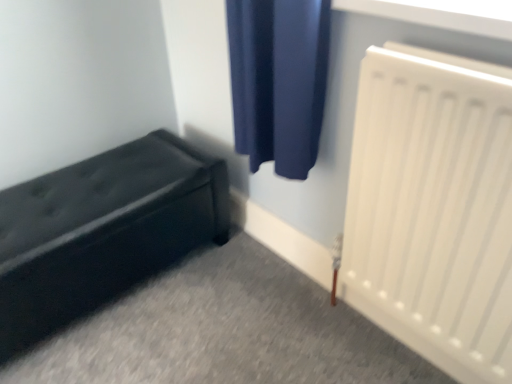
Find the location of a particular element. black leather bench at lower left is located at coordinates (102, 231).

Based on the photo, what is the approximate width of black leather bench at lower left?

black leather bench at lower left is 46.12 centimeters in width.

Measure the distance between black leather bench at lower left and camera.

black leather bench at lower left and camera are 1.06 meters apart.

The width and height of the screenshot is (512, 384). Describe the element at coordinates (102, 231) in the screenshot. I see `black leather bench at lower left` at that location.

Find the location of a particular element. The height and width of the screenshot is (384, 512). white plastic radiator at right is located at coordinates (433, 208).

This screenshot has width=512, height=384. Describe the element at coordinates (433, 208) in the screenshot. I see `white plastic radiator at right` at that location.

Image resolution: width=512 pixels, height=384 pixels. I want to click on black leather bench at lower left, so click(102, 231).

Which object is positioned more to the left, white plastic radiator at right or black leather bench at lower left?

Positioned to the left is black leather bench at lower left.

Is white plastic radiator at right in front of or behind black leather bench at lower left in the image?

white plastic radiator at right is in front of black leather bench at lower left.

Considering the positions of point (445, 181) and point (115, 172), is point (445, 181) closer or farther from the camera than point (115, 172)?

Point (445, 181) appears to be closer to the viewer than point (115, 172).

From the image's perspective, is white plastic radiator at right under black leather bench at lower left?

No, from the image's perspective, white plastic radiator at right is not beneath black leather bench at lower left.

From a real-world perspective, which is physically below, white plastic radiator at right or black leather bench at lower left?

black leather bench at lower left, from a real-world perspective.

Between white plastic radiator at right and black leather bench at lower left, which one has larger width?

With larger width is black leather bench at lower left.

Considering the relative sizes of white plastic radiator at right and black leather bench at lower left in the image provided, is white plastic radiator at right shorter than black leather bench at lower left?

In fact, white plastic radiator at right may be taller than black leather bench at lower left.

Considering the relative sizes of white plastic radiator at right and black leather bench at lower left in the image provided, is white plastic radiator at right smaller than black leather bench at lower left?

Correct, white plastic radiator at right occupies less space than black leather bench at lower left.

Is black leather bench at lower left completely or partially inside white plastic radiator at right?

No, black leather bench at lower left is located outside of white plastic radiator at right.

Would you consider white plastic radiator at right to be distant from black leather bench at lower left?

No, white plastic radiator at right is not far away from black leather bench at lower left.

Is white plastic radiator at right looking in the opposite direction of black leather bench at lower left?

white plastic radiator at right does not have its back to black leather bench at lower left.

How many degrees apart are the facing directions of white plastic radiator at right and black leather bench at lower left?

There is a 92-degree angle between the facing directions of white plastic radiator at right and black leather bench at lower left.

Image resolution: width=512 pixels, height=384 pixels. I want to click on radiator located above the black leather bench at lower left (from the image's perspective), so click(433, 208).

Between black leather bench at lower left and white plastic radiator at right, which one appears on the right side from the viewer's perspective?

From the viewer's perspective, white plastic radiator at right appears more on the right side.

Considering the positions of objects black leather bench at lower left and white plastic radiator at right in the image provided, who is behind, black leather bench at lower left or white plastic radiator at right?

black leather bench at lower left is more distant.

Does point (95, 285) appear closer or farther from the camera than point (485, 349)?

Point (95, 285) is farther from the camera than point (485, 349).

From the image's perspective, is black leather bench at lower left below white plastic radiator at right?

Yes, from the image's perspective, black leather bench at lower left is beneath white plastic radiator at right.

From a real-world perspective, is black leather bench at lower left physically above white plastic radiator at right?

No, from a real-world perspective, black leather bench at lower left is not over white plastic radiator at right

Which of these two, black leather bench at lower left or white plastic radiator at right, is thinner?

Thinner between the two is white plastic radiator at right.

Who is shorter, black leather bench at lower left or white plastic radiator at right?

black leather bench at lower left is shorter.

Based on their sizes in the image, would you say black leather bench at lower left is bigger or smaller than white plastic radiator at right?

Considering their sizes, black leather bench at lower left takes up more space than white plastic radiator at right.

Would you say white plastic radiator at right is part of black leather bench at lower left's contents?

No, white plastic radiator at right is not inside black leather bench at lower left.

Is black leather bench at lower left far from white plastic radiator at right?

black leather bench at lower left is actually quite close to white plastic radiator at right.

Is black leather bench at lower left positioned with its back to white plastic radiator at right?

That's not correct — black leather bench at lower left is not looking away from white plastic radiator at right.

How many degrees apart are the facing directions of black leather bench at lower left and white plastic radiator at right?

92 degrees.

At what (x,y) coordinates should I click in order to perform the action: click on furniture located behind the white plastic radiator at right. Please return your answer as a coordinate pair (x, y). Image resolution: width=512 pixels, height=384 pixels. Looking at the image, I should click on (102, 231).

Locate an element on the screen. furniture behind the white plastic radiator at right is located at coordinates (102, 231).

This screenshot has width=512, height=384. I want to click on radiator above the black leather bench at lower left (from a real-world perspective), so click(x=433, y=208).